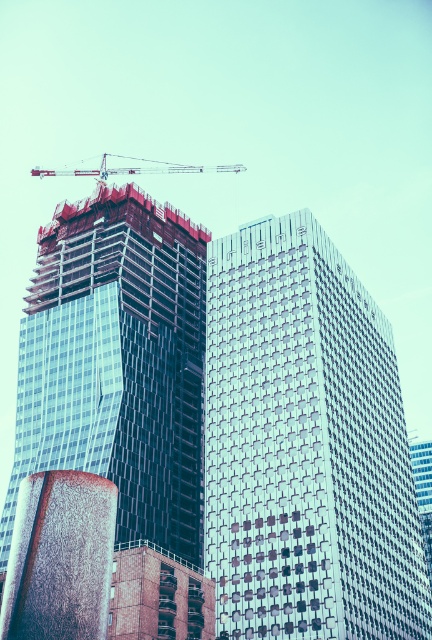
Can you confirm if glassy steel tower at center is positioned above white metallic crane at upper center?

Actually, glassy steel tower at center is below white metallic crane at upper center.

Is glassy steel tower at center smaller than white metallic crane at upper center?

Yes, glassy steel tower at center is smaller than white metallic crane at upper center.

Describe the element at coordinates (117, 362) in the screenshot. I see `glassy steel tower at center` at that location.

At what (x,y) coordinates should I click in order to perform the action: click on glassy steel tower at center. Please return your answer as a coordinate pair (x, y). Looking at the image, I should click on (117, 362).

Does glassy reflective building at center appear on the right side of glassy steel tower at center?

Yes, glassy reflective building at center is to the right of glassy steel tower at center.

Is glassy reflective building at center positioned in front of glassy steel tower at center?

That is True.

Between point (253, 227) and point (158, 310), which one is positioned behind?

Positioned behind is point (158, 310).

Locate an element on the screen. glassy reflective building at center is located at coordinates (305, 445).

Who is more distant from viewer, (311, 365) or (51, 172)?

Point (51, 172)

Image resolution: width=432 pixels, height=640 pixels. What do you see at coordinates (305, 445) in the screenshot?
I see `glassy reflective building at center` at bounding box center [305, 445].

You are a GUI agent. You are given a task and a screenshot of the screen. Output one action in this format:
    pyautogui.click(x=<x>, y=<y>)
    Task: Click on the glassy reflective building at center
    
    Given the screenshot: What is the action you would take?
    pyautogui.click(x=305, y=445)